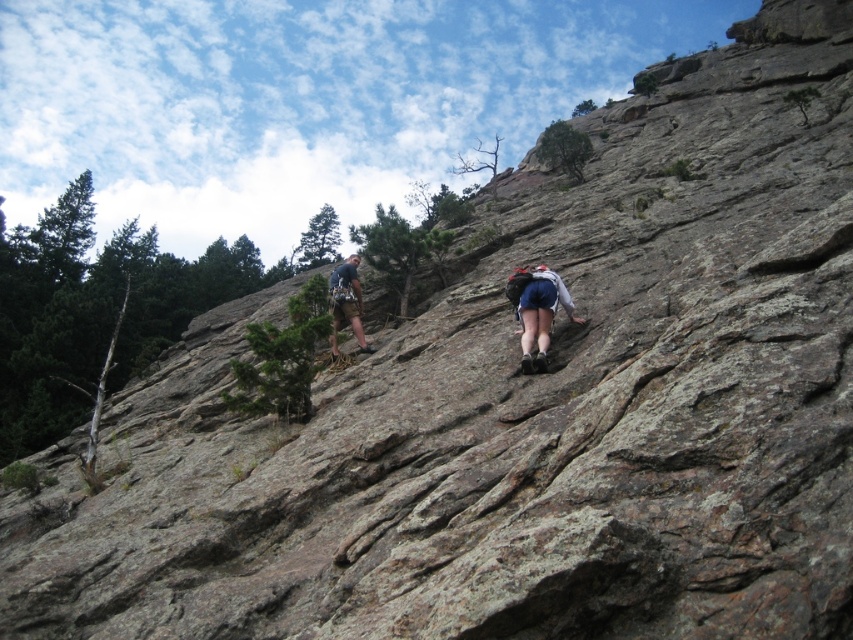
Question: Is blue denim shorts at center bigger than matte gray climbing harness at center?

Choices:
 (A) no
 (B) yes

Answer: (A)

Question: Does blue denim shorts at center appear over matte gray climbing harness at center?

Choices:
 (A) yes
 (B) no

Answer: (B)

Question: Does blue denim shorts at center have a larger size compared to matte gray climbing harness at center?

Choices:
 (A) no
 (B) yes

Answer: (A)

Question: Which of the following is the closest to the observer?

Choices:
 (A) (550, 301)
 (B) (335, 273)

Answer: (A)

Question: Which of the following is the farthest from the observer?

Choices:
 (A) matte gray climbing harness at center
 (B) blue denim shorts at center

Answer: (A)

Question: Which point appears farthest from the camera in this image?

Choices:
 (A) (529, 346)
 (B) (335, 269)

Answer: (B)